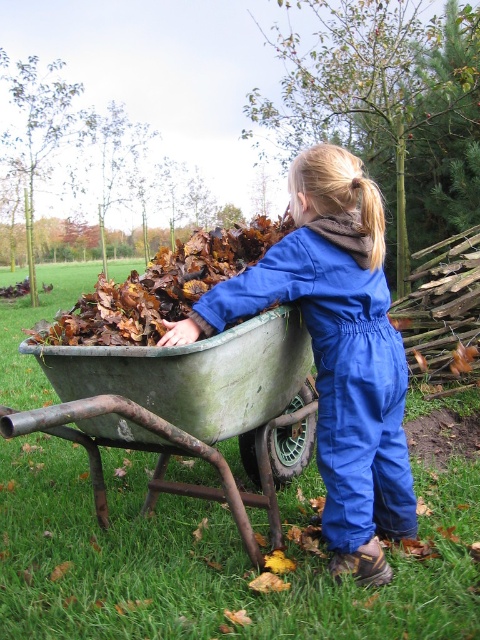
You are a parent observing your child in the garden. You notice the rusty metal wheelbarrow at center and the brown fuzzy hair at upper center. Which object is taller? Please answer based on their positions in the image.

The rusty metal wheelbarrow at center is taller than brown fuzzy hair at upper center.

Consider the image. The child is wearing a blue cotton jumpsuit at center and pushing a rusty metal wheelbarrow at center. Which object is closer to the viewer?

The blue cotton jumpsuit at center is closer to the viewer because the rusty metal wheelbarrow at center is behind it.

You are standing in the garden and see the blue cotton jumpsuit at center. If you want to hand the child a watering can that is 1.8 meters long, can you reach them without moving closer?

The blue cotton jumpsuit at center and viewer are 2.15 meters apart from each other. Since the watering can is only 1.8 meters long, you cannot reach the child without moving closer.